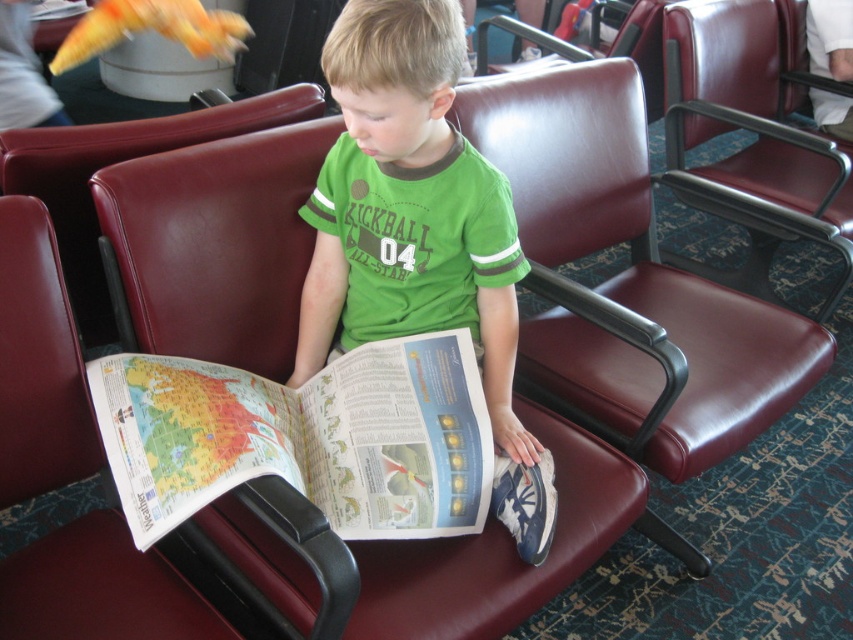
Does printed paper map at center appear on the left side of maroon leather chair at center?

No, printed paper map at center is not to the left of maroon leather chair at center.

Who is more forward, (242, 381) or (189, 124)?

Point (242, 381) is in front.

Identify the location of printed paper map at center. (305, 436).

Is point (479, 365) positioned after point (80, 202)?

That is False.

Is green jersey at center taller than maroon leather chair at center?

Yes.

Is point (329, 164) positioned after point (248, 104)?

No, it is not.

Where is `green jersey at center`? The image size is (853, 640). green jersey at center is located at coordinates [419, 230].

Is point (416, 422) positioned behind point (694, 122)?

No, it is in front of (694, 122).

Does printed paper map at center appear on the left side of maroon leather armchair at center?

Correct, you'll find printed paper map at center to the left of maroon leather armchair at center.

Who is more distant from viewer, (262, 417) or (815, 156)?

The point (815, 156) is behind.

Locate an element on the screen. printed paper map at center is located at coordinates (305, 436).